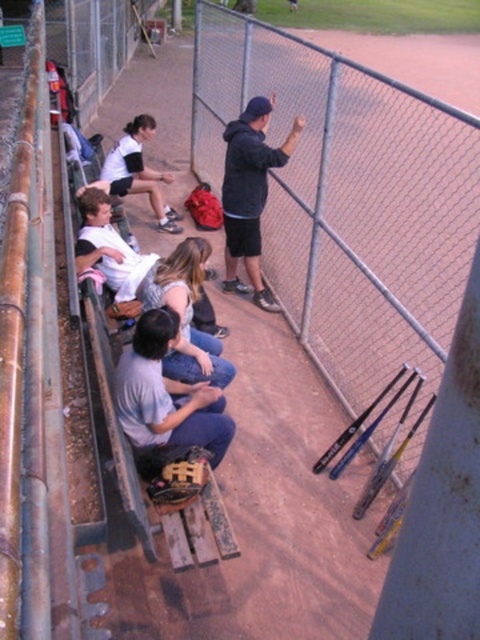
Which is in front, point (272, 278) or point (205, 316)?

Point (205, 316) is more forward.

You are a GUI agent. You are given a task and a screenshot of the screen. Output one action in this format:
    pyautogui.click(x=<x>, y=<y>)
    Task: Click on the metal chain-link fence at center
    The image size is (480, 640).
    Given the screenshot: What is the action you would take?
    pyautogui.click(x=348, y=198)

The width and height of the screenshot is (480, 640). Describe the element at coordinates (348, 198) in the screenshot. I see `metal chain-link fence at center` at that location.

In order to click on metal chain-link fence at center in this screenshot , I will do `click(348, 198)`.

Who is positioned more to the right, denim jeans at center or white cotton shirt at center?

Positioned to the right is denim jeans at center.

The width and height of the screenshot is (480, 640). What do you see at coordinates (186, 314) in the screenshot?
I see `denim jeans at center` at bounding box center [186, 314].

Where is `denim jeans at center`? The height and width of the screenshot is (640, 480). denim jeans at center is located at coordinates (186, 314).

Who is taller, metal chain-link fence at center or white matte shirt at upper left?

With more height is metal chain-link fence at center.

Which is more to the left, metal chain-link fence at center or white matte shirt at upper left?

From the viewer's perspective, white matte shirt at upper left appears more on the left side.

Where is `metal chain-link fence at center`? This screenshot has height=640, width=480. metal chain-link fence at center is located at coordinates (348, 198).